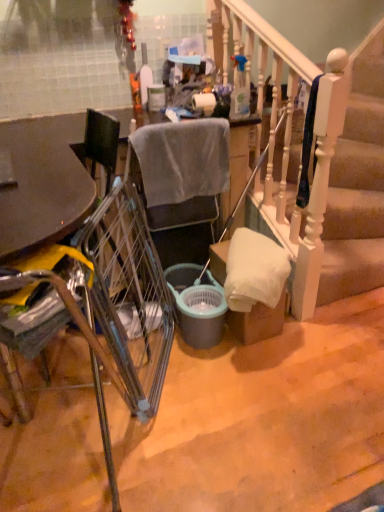
Question: From the image's perspective, relative to translucent plastic bottle at upper center, the 1th bottle positioned from the back, is gray fabric chair at center, the 2th chair when ordered from front to back, above or below?

Choices:
 (A) above
 (B) below

Answer: (B)

Question: Is point (223, 186) closer or farther from the camera than point (130, 78)?

Choices:
 (A) farther
 (B) closer

Answer: (B)

Question: Which object is positioned farthest from the matte gray bucket at center?

Choices:
 (A) metallic silver chair at left, arranged as the second chair when viewed from the back
 (B) clear plastic spray bottle at upper center, marked as the first bottle in a right-to-left arrangement
 (C) matte plastic trash can at center
 (D) translucent plastic bottle at upper center, the 1th bottle positioned from the back
 (E) white wooden stairs at center

Answer: (D)

Question: Estimate the real-world distances between objects in this image. Which object is closer to the metallic silver chair at left, arranged as the second chair when viewed from the back?

Choices:
 (A) white matte toilet paper at center
 (B) translucent plastic bottle at upper center, the 1th bottle positioned from the back
 (C) white wooden stairs at center
 (D) clear plastic spray bottle at upper center, marked as the first bottle in a right-to-left arrangement
 (E) metallic silver trolley at center

Answer: (E)